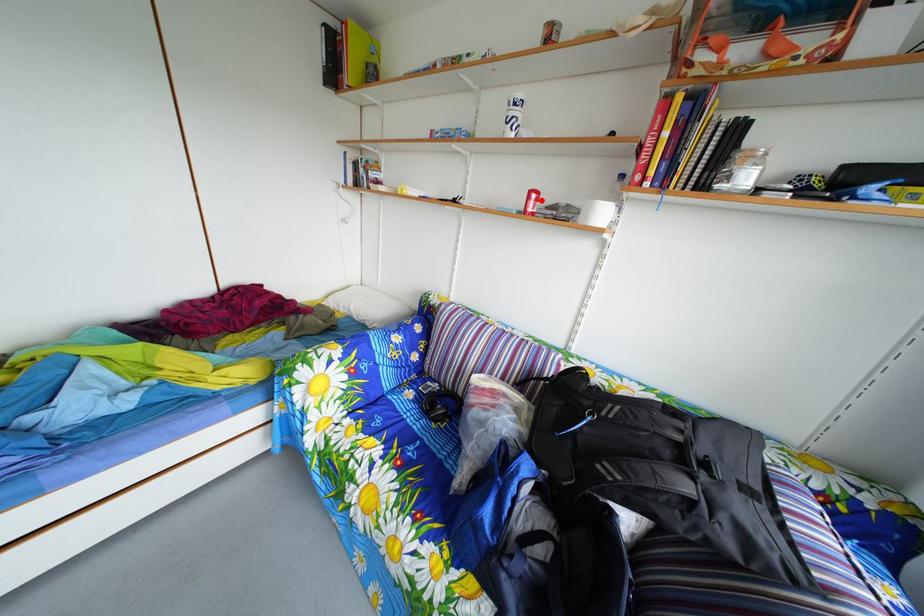
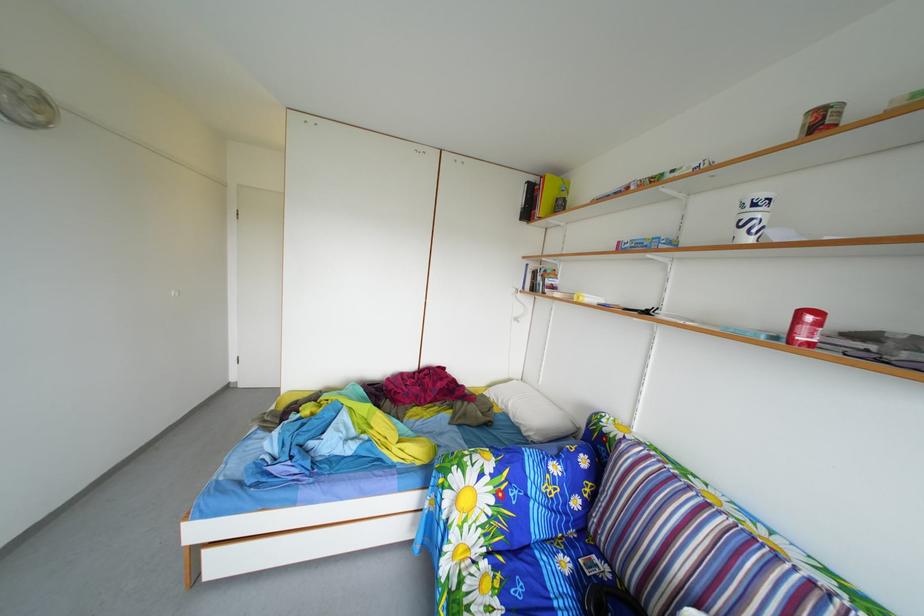
In the second image, find the point that corresponds to the highlighted location in the first image.

(811, 321)